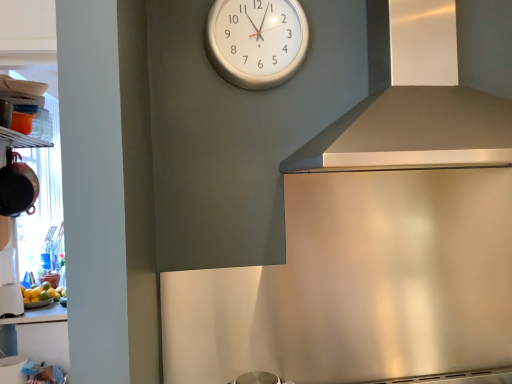
Question: Is satin silver exhaust hood at upper right surrounded by matte black pot at left, the first appliance from the top?

Choices:
 (A) yes
 (B) no

Answer: (B)

Question: From a real-world perspective, is matte black pot at left, the first appliance from the top, beneath satin silver exhaust hood at upper right?

Choices:
 (A) yes
 (B) no

Answer: (A)

Question: Is matte black pot at left, the first appliance from the top, in front of satin silver exhaust hood at upper right?

Choices:
 (A) no
 (B) yes

Answer: (A)

Question: Is matte black pot at left, the first appliance from the top, outside of satin silver exhaust hood at upper right?

Choices:
 (A) yes
 (B) no

Answer: (A)

Question: Is matte black pot at left, the first appliance from the top, wider than satin silver exhaust hood at upper right?

Choices:
 (A) yes
 (B) no

Answer: (B)

Question: Does matte black pot at left, the first appliance from the top, have a smaller size compared to satin silver exhaust hood at upper right?

Choices:
 (A) no
 (B) yes

Answer: (B)

Question: Can you confirm if yellow matte bowl at lower left is thinner than satin silver exhaust hood at upper right?

Choices:
 (A) no
 (B) yes

Answer: (B)

Question: Considering the relative sizes of yellow matte bowl at lower left and satin silver exhaust hood at upper right in the image provided, is yellow matte bowl at lower left shorter than satin silver exhaust hood at upper right?

Choices:
 (A) yes
 (B) no

Answer: (A)

Question: Could you tell me if yellow matte bowl at lower left is turned towards satin silver exhaust hood at upper right?

Choices:
 (A) no
 (B) yes

Answer: (A)

Question: Is satin silver exhaust hood at upper right a part of yellow matte bowl at lower left?

Choices:
 (A) no
 (B) yes

Answer: (A)

Question: Is yellow matte bowl at lower left positioned far away from satin silver exhaust hood at upper right?

Choices:
 (A) yes
 (B) no

Answer: (A)

Question: From a real-world perspective, does yellow matte bowl at lower left sit lower than satin silver exhaust hood at upper right?

Choices:
 (A) no
 (B) yes

Answer: (B)

Question: Can you confirm if satin silver exhaust hood at upper right is taller than white glossy cup at lower left, which is counted as the first appliance, starting from the bottom?

Choices:
 (A) no
 (B) yes

Answer: (B)